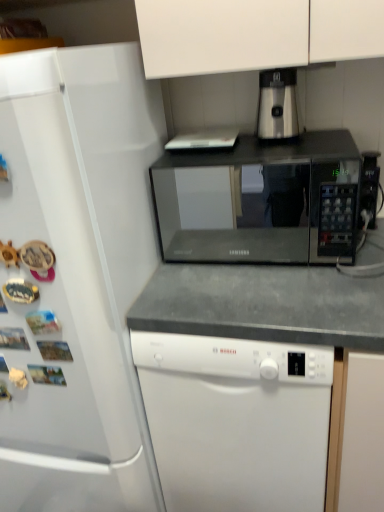
You are a GUI agent. You are given a task and a screenshot of the screen. Output one action in this format:
    pyautogui.click(x=<x>, y=<y>)
    Task: Click on the free space below black matte microwave at center (from a real-world perspective)
    
    Given the screenshot: What is the action you would take?
    pyautogui.click(x=256, y=245)